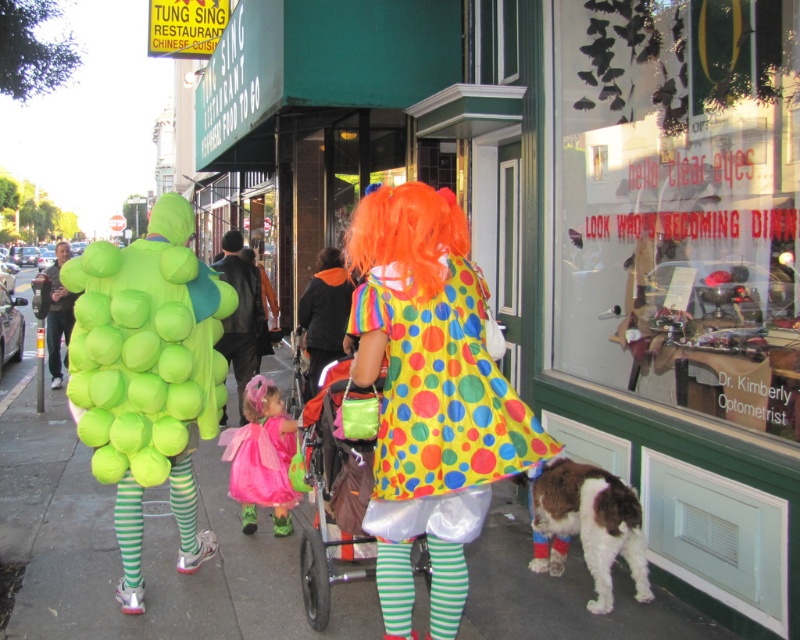
You are standing in the middle of the street and want to look up at the clear glass window at upper right. Based on its 2D coordinates, is it located to your left or right side?

The clear glass window at upper right is located at point 0.319 on the x axis, which is to the left side from the center of the image. Therefore, when standing in the middle of the street, the clear glass window at upper right would be to your left side.

You are a photographer standing in the middle of the street. You notice a white fluffy dog at lower right and a rainbow polka dot dress at center. Which object is positioned lower in the image?

The white fluffy dog at lower right is located below the rainbow polka dot dress at center, so it is positioned lower in the image.

You are a parent pushing a polyester fabric stroller at center while holding an orange synthetic wig at center. Can you easily carry both items through a narrow doorway that is 70 cm wide?

The polyester fabric stroller at center has a larger size compared to orange synthetic wig at center. Since the stroller is larger, it may not fit through the 70 cm wide doorway, making it difficult to carry both items together.